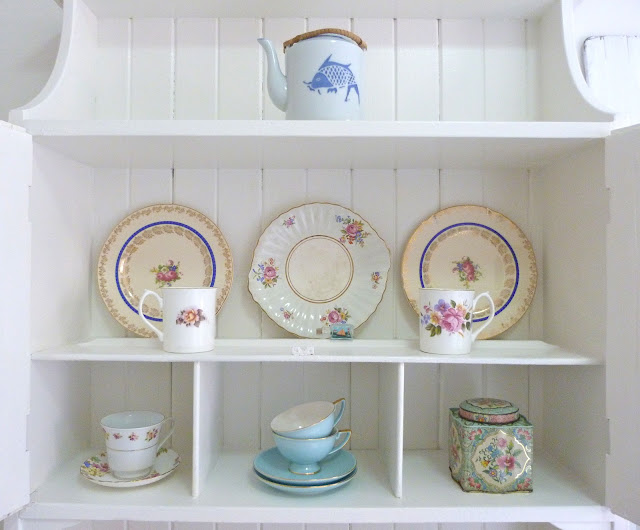
Find the location of a particular element. The width and height of the screenshot is (640, 530). white wood wall is located at coordinates (147, 385), (285, 375), (470, 374), (413, 199), (282, 190), (141, 184), (162, 42), (489, 58).